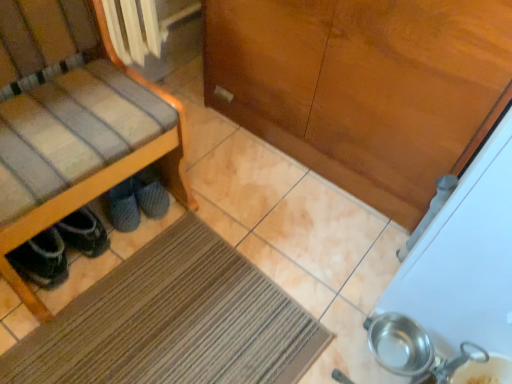
This screenshot has width=512, height=384. What are the coordinates of `unoccupied area in front of wooden cabinet at center` in the screenshot? It's located at (267, 255).